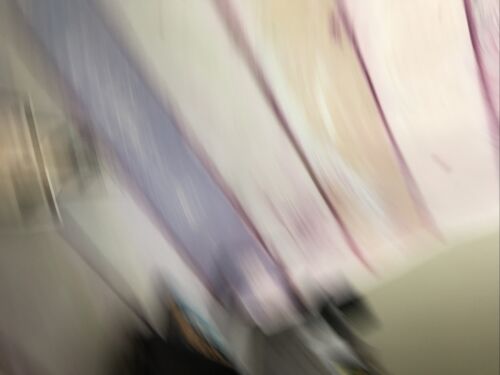
Locate an element on the screen. wall is located at coordinates (431, 306), (54, 278).